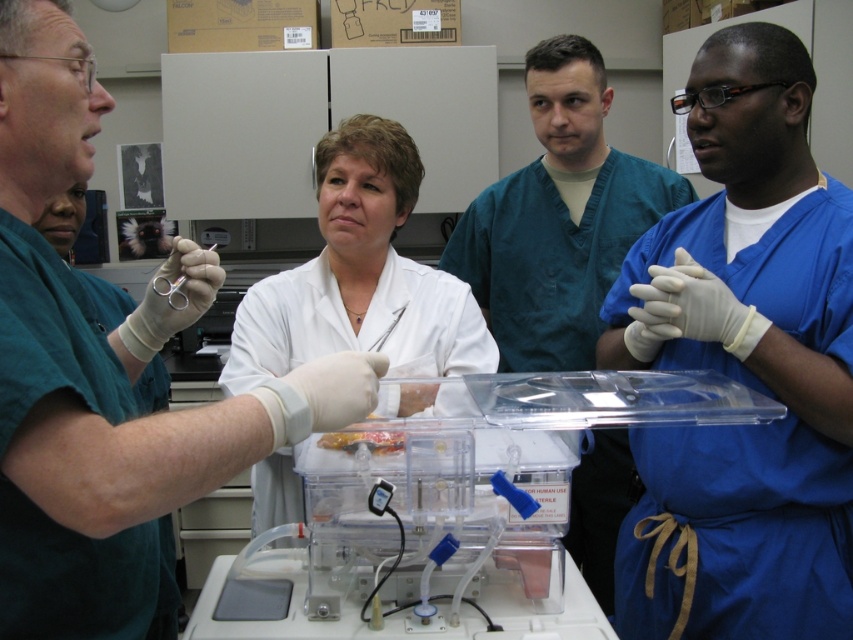
Question: Can you confirm if blue scrubs at center is positioned to the right of white lab coat at center?

Choices:
 (A) yes
 (B) no

Answer: (A)

Question: Is blue scrubs at right closer to the viewer compared to white matte lab coat at upper center?

Choices:
 (A) yes
 (B) no

Answer: (B)

Question: Which point is farther from the camera taking this photo?

Choices:
 (A) (262, 291)
 (B) (668, 634)
 (C) (251, 593)

Answer: (A)

Question: Which point appears closest to the camera in this image?

Choices:
 (A) click(x=502, y=225)
 (B) click(x=459, y=387)

Answer: (B)

Question: Which point is farther from the camera taking this photo?

Choices:
 (A) (386, 224)
 (B) (560, 589)
 (C) (62, 136)

Answer: (A)

Question: Does blue scrubs at right have a greater width compared to white matte lab coat at upper center?

Choices:
 (A) no
 (B) yes

Answer: (A)